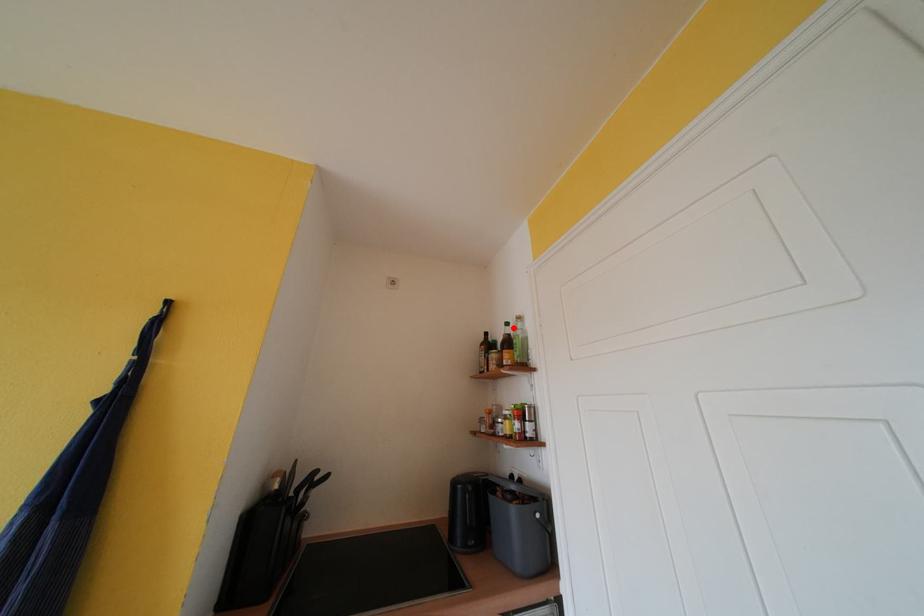
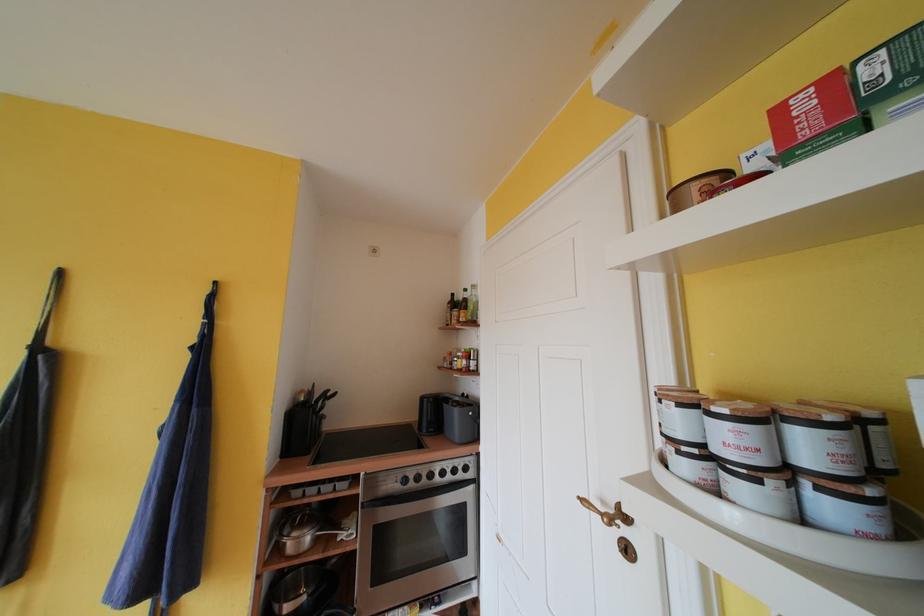
Find the pixel in the second image that matches the highlighted location in the first image.

(471, 294)